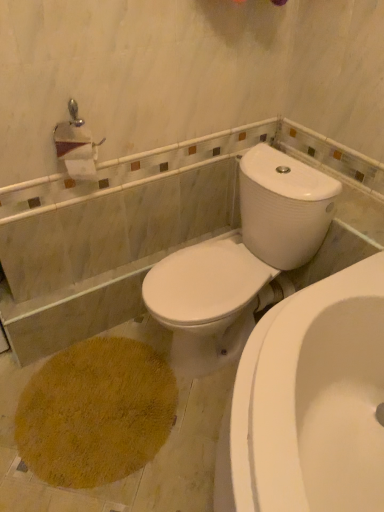
Question: Do you think white glossy water tank at upper right is within white glossy toilet at center, or outside of it?

Choices:
 (A) inside
 (B) outside

Answer: (B)

Question: Considering the positions of point (296, 256) and point (175, 303), is point (296, 256) closer or farther from the camera than point (175, 303)?

Choices:
 (A) farther
 (B) closer

Answer: (A)

Question: From a real-world perspective, relative to white glossy toilet at center, is white glossy water tank at upper right vertically above or below?

Choices:
 (A) below
 (B) above

Answer: (B)

Question: Is point [178, 249] closer or farther from the camera than point [253, 187]?

Choices:
 (A) farther
 (B) closer

Answer: (A)

Question: Is white glossy toilet at center taller or shorter than white glossy water tank at upper right?

Choices:
 (A) short
 (B) tall

Answer: (B)

Question: Looking at their shapes, would you say white glossy toilet at center is wider or thinner than white glossy water tank at upper right?

Choices:
 (A) thin
 (B) wide

Answer: (B)

Question: From the image's perspective, is white glossy toilet at center located above or below white glossy water tank at upper right?

Choices:
 (A) above
 (B) below

Answer: (B)